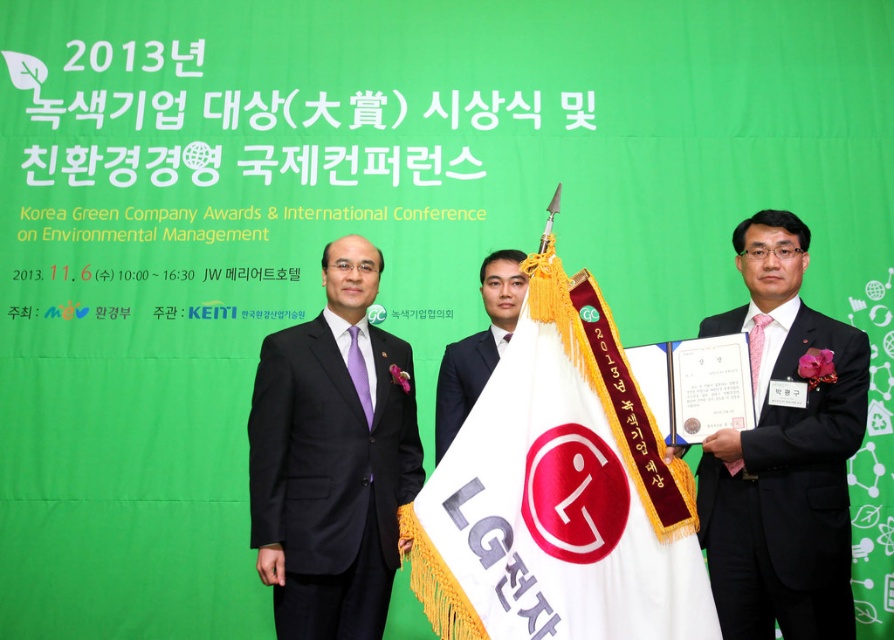
Question: Does black suit at center appear over smooth black suit at center?

Choices:
 (A) no
 (B) yes

Answer: (A)

Question: Can you confirm if black suit at center is positioned to the left of dark gray suit at right?

Choices:
 (A) no
 (B) yes

Answer: (B)

Question: Which object is positioned closest to the smooth black suit at center?

Choices:
 (A) dark gray suit at right
 (B) black suit at center
 (C) white fabric flag at center

Answer: (B)

Question: Can you confirm if white fabric flag at center is positioned below smooth black suit at center?

Choices:
 (A) yes
 (B) no

Answer: (A)

Question: Which point appears closest to the camera in this image?

Choices:
 (A) (302, 381)
 (B) (450, 364)
 (C) (587, 582)
 (D) (780, 308)

Answer: (C)

Question: Which of the following is the farthest from the observer?

Choices:
 (A) (401, 492)
 (B) (546, 520)
 (C) (496, 262)
 (D) (798, 320)

Answer: (C)